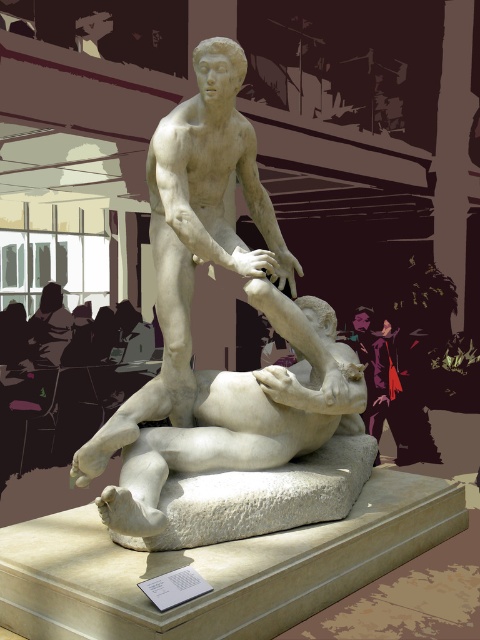
Question: Can you confirm if white marble statue at center is positioned above white marble/stone at center?

Choices:
 (A) no
 (B) yes

Answer: (B)

Question: Which point is farther to the camera?

Choices:
 (A) white marble/stone at center
 (B) white marble statue at center

Answer: (A)

Question: Is white marble statue at center below white marble/stone at center?

Choices:
 (A) yes
 (B) no

Answer: (B)

Question: Is white marble statue at center above white marble/stone at center?

Choices:
 (A) no
 (B) yes

Answer: (B)